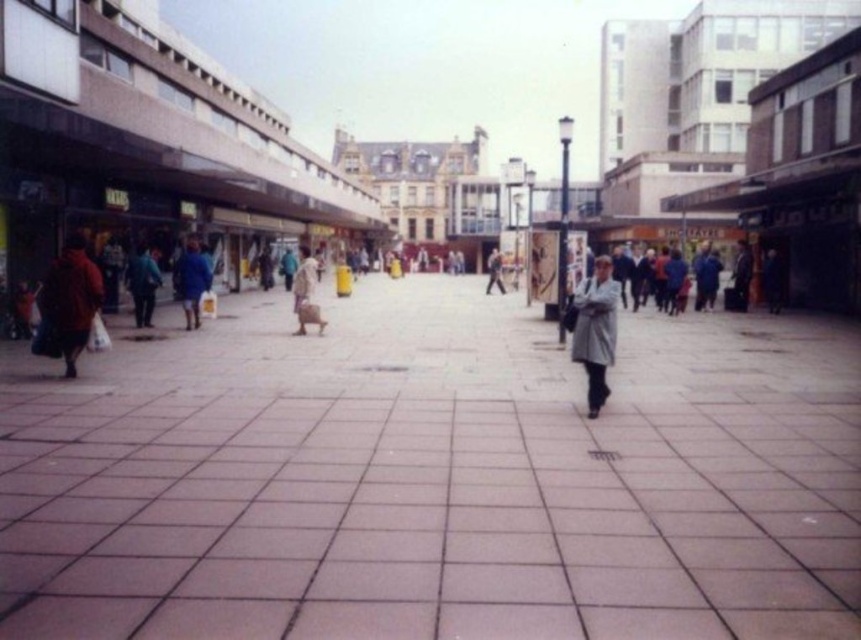
Question: Is light gray coat at center behind light brown fabric bag at center?

Choices:
 (A) yes
 (B) no

Answer: (B)

Question: Does light gray coat at center appear under light brown fabric bag at center?

Choices:
 (A) no
 (B) yes

Answer: (B)

Question: Does light gray coat at center appear on the left side of light brown fabric bag at center?

Choices:
 (A) yes
 (B) no

Answer: (B)

Question: Estimate the real-world distances between objects in this image. Which object is farther from the light brown fabric bag at center?

Choices:
 (A) matte gray coat at center
 (B) light gray coat at center

Answer: (A)

Question: Which of these objects is positioned closest to the light gray coat at center?

Choices:
 (A) matte gray coat at center
 (B) light brown fabric bag at center

Answer: (B)

Question: Which of the following is the farthest from the observer?

Choices:
 (A) light brown fabric bag at center
 (B) matte gray coat at center

Answer: (B)